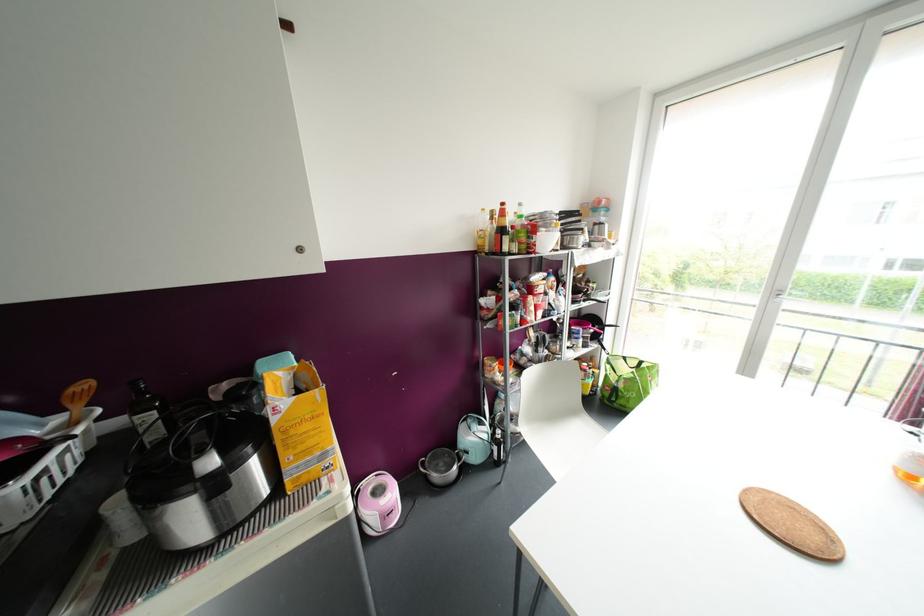
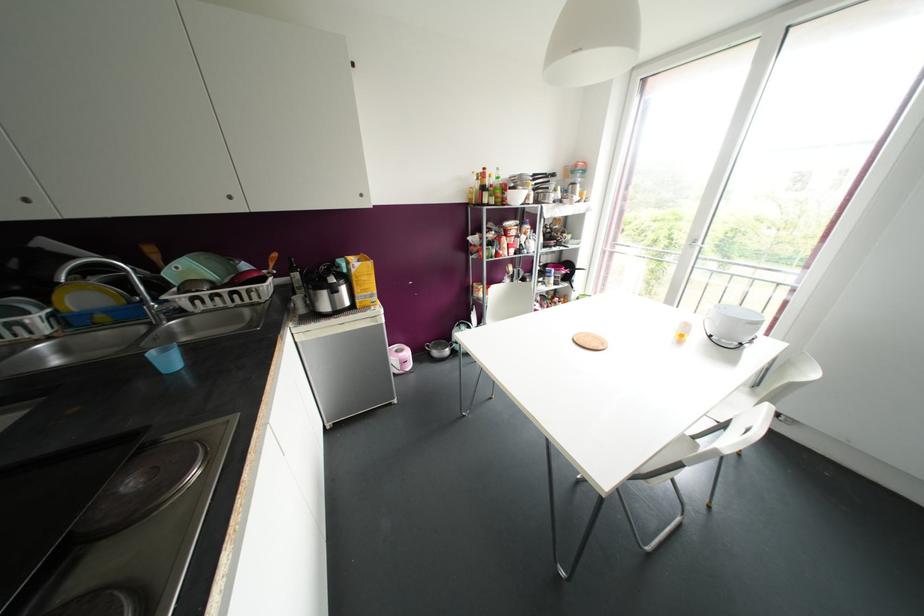
Locate, in the second image, the point that corresponds to (x=605, y=225) in the first image.

(578, 185)